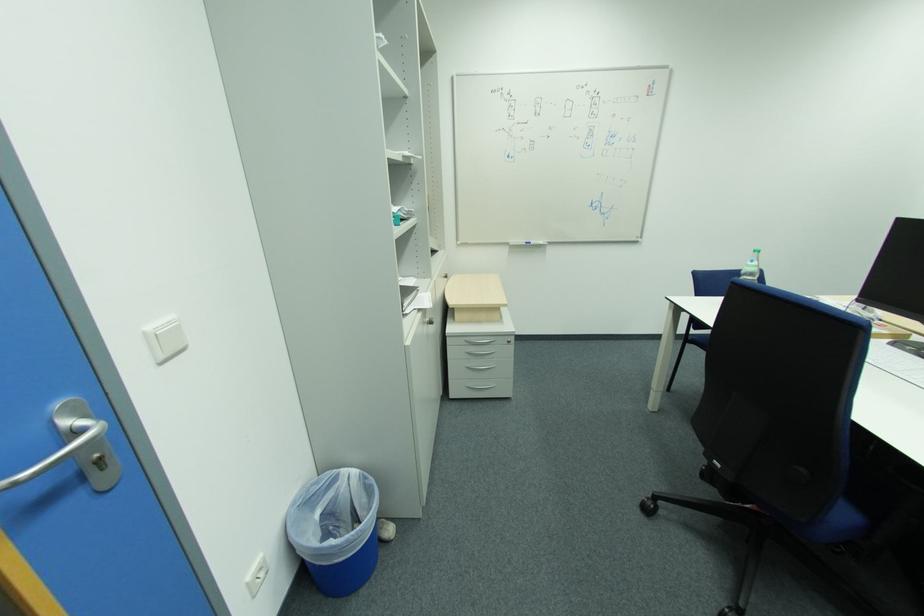
At what (x,y) coordinates should I click in order to perform the action: click on silver drawer handle. Please return your answer as a coordinate pair (x, y). Looking at the image, I should click on (480, 365).